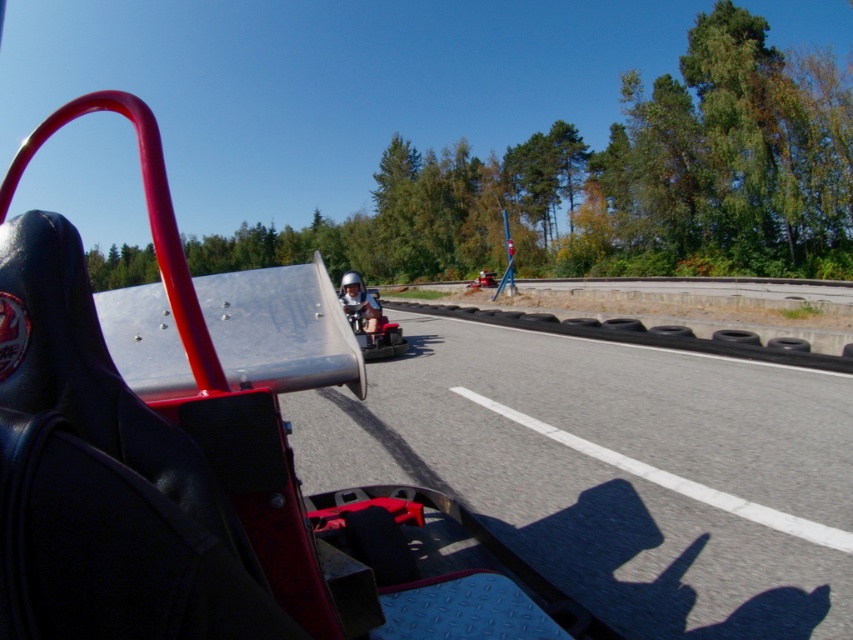
You are driving a go kart and need to stay on the track. The track is the smooth asphalt highway at center. Where should you position your kart to stay on the track?

The smooth asphalt highway at center is located at point (614, 470), so you should position your kart there to stay on the track.

You are driving a go kart and see the smooth asphalt highway at center and the shiny silver helmet at center. Which object is closer to you?

The shiny silver helmet at center is closer to you because it is only 6.27 meters away from the smooth asphalt highway at center, which is further ahead.